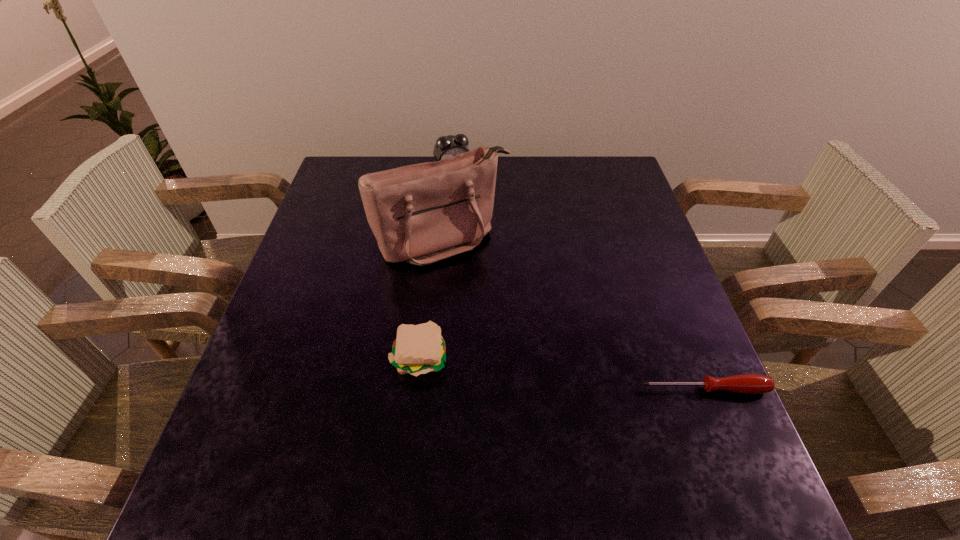
In the image, there is a desktop. Where is `vacant area at the far left corner`? Image resolution: width=960 pixels, height=540 pixels. vacant area at the far left corner is located at coordinates [x=351, y=165].

In the image, there is a desktop. Where is `blank space at the near left corner`? blank space at the near left corner is located at coordinates (285, 428).

The width and height of the screenshot is (960, 540). Identify the location of vacant region at the near right corner of the desktop. (696, 433).

You are a GUI agent. You are given a task and a screenshot of the screen. Output one action in this format:
    pyautogui.click(x=<x>, y=<y>)
    Task: Click on the free space between the second farthest object and the shortest object
    This screenshot has width=960, height=540.
    Given the screenshot: What is the action you would take?
    [x=573, y=315]

Locate an element on the screen. The width and height of the screenshot is (960, 540). free space between the screwdriver and the third tallest object is located at coordinates (562, 373).

At what (x,y) coordinates should I click in order to perform the action: click on free space that is in between the tallest object and the third tallest object. Please return your answer as a coordinate pair (x, y). The image size is (960, 540). Looking at the image, I should click on (432, 299).

Locate an element on the screen. The width and height of the screenshot is (960, 540). vacant point located between the third nearest object and the shortest object is located at coordinates (573, 315).

At what (x,y) coordinates should I click in order to perform the action: click on free space between the alarm clock and the second shortest object. Please return your answer as a coordinate pair (x, y). Image resolution: width=960 pixels, height=540 pixels. Looking at the image, I should click on 437,265.

Identify the location of free space between the shoulder bag and the rightmost object. (573, 315).

Locate an element on the screen. This screenshot has height=540, width=960. free space between the patty and the farthest object is located at coordinates (437, 265).